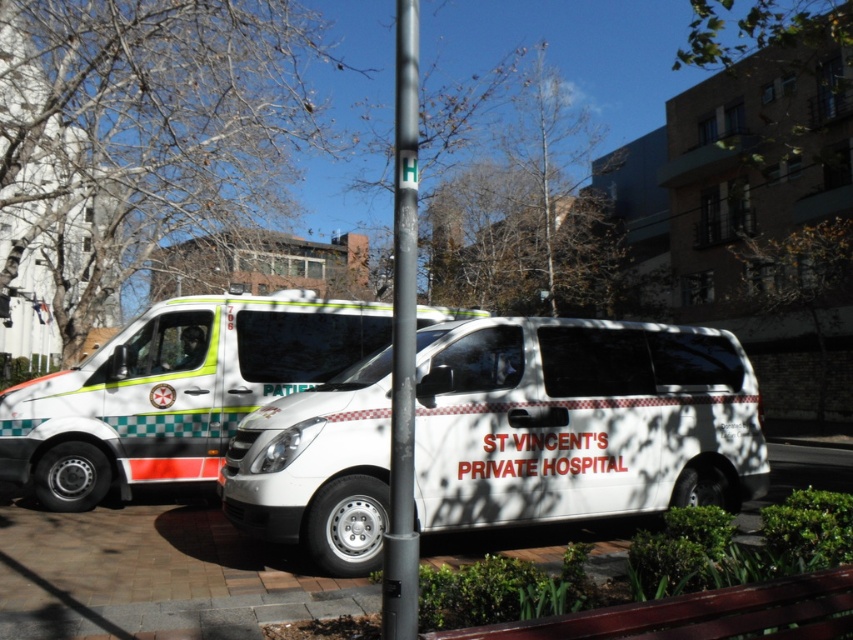
Question: Is white brick pavement at center closer to the viewer compared to white glossy van at left?

Choices:
 (A) no
 (B) yes

Answer: (B)

Question: Which point is closer to the camera taking this photo?

Choices:
 (A) (194, 374)
 (B) (399, 266)
 (C) (146, 573)
 (D) (321, 483)

Answer: (B)

Question: Which of the following is the farthest from the observer?

Choices:
 (A) (395, 97)
 (B) (252, 620)
 (C) (225, 356)
 (D) (611, 509)

Answer: (C)

Question: Is white glossy van at center closer to the viewer compared to white brick pavement at center?

Choices:
 (A) yes
 (B) no

Answer: (B)

Question: Can you confirm if white brick pavement at center is wider than white glossy van at left?

Choices:
 (A) yes
 (B) no

Answer: (A)

Question: Which object is positioned farthest from the white glossy van at center?

Choices:
 (A) white glossy van at left
 (B) black smooth pole at center

Answer: (B)